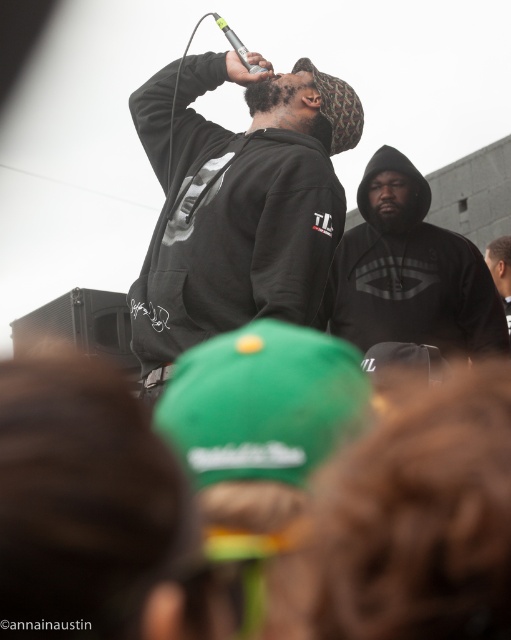
Question: Is the position of matte black hoodie at center more distant than that of black matte hoodie at center?

Choices:
 (A) no
 (B) yes

Answer: (A)

Question: Can you confirm if matte black hoodie at center is wider than black matte hoodie at center?

Choices:
 (A) no
 (B) yes

Answer: (B)

Question: Which object appears farthest from the camera in this image?

Choices:
 (A) black matte hoodie at center
 (B) matte black hoodie at center

Answer: (A)

Question: Which object appears farthest from the camera in this image?

Choices:
 (A) black matte hoodie at center
 (B) matte black hoodie at center

Answer: (A)

Question: Is matte black hoodie at center bigger than black matte hoodie at center?

Choices:
 (A) no
 (B) yes

Answer: (B)